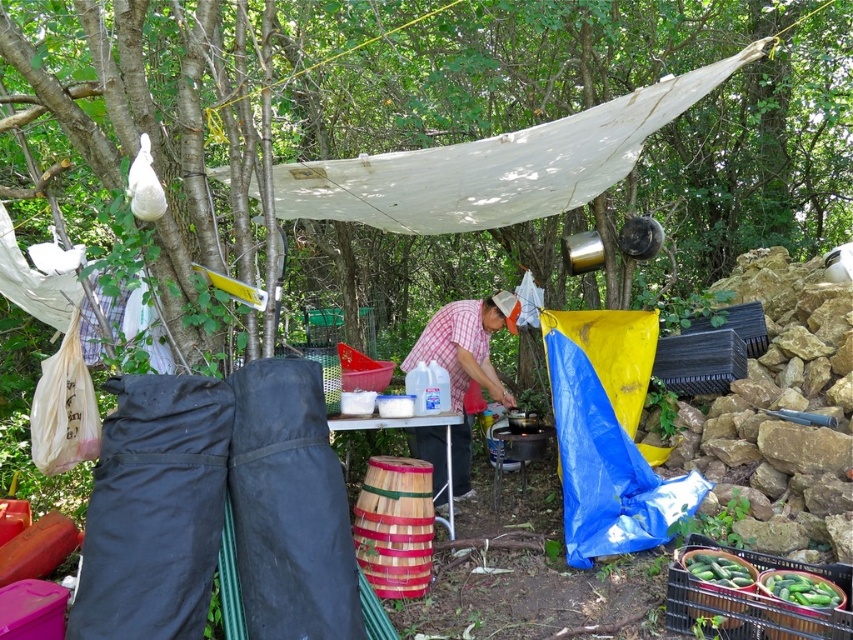
Question: Which point is farther to the camera?

Choices:
 (A) green matte cucumber at lower right
 (B) brown wood tree at upper left
 (C) plaid shirt at center

Answer: (B)

Question: Does brown wood tree at upper left have a smaller size compared to plaid shirt at center?

Choices:
 (A) no
 (B) yes

Answer: (A)

Question: Which point is farther to the camera?

Choices:
 (A) (599, 464)
 (B) (434, 321)
 (C) (36, 118)
 (D) (822, 596)

Answer: (B)

Question: Is brown wood tree at upper left to the left of blue tarp at lower right from the viewer's perspective?

Choices:
 (A) yes
 (B) no

Answer: (B)

Question: Which object appears farthest from the camera in this image?

Choices:
 (A) green matte cucumbers at lower right
 (B) plaid shirt at center
 (C) brown wood tree at upper left

Answer: (C)

Question: Does brown wood tree at upper left have a larger size compared to blue tarp at lower right?

Choices:
 (A) yes
 (B) no

Answer: (A)